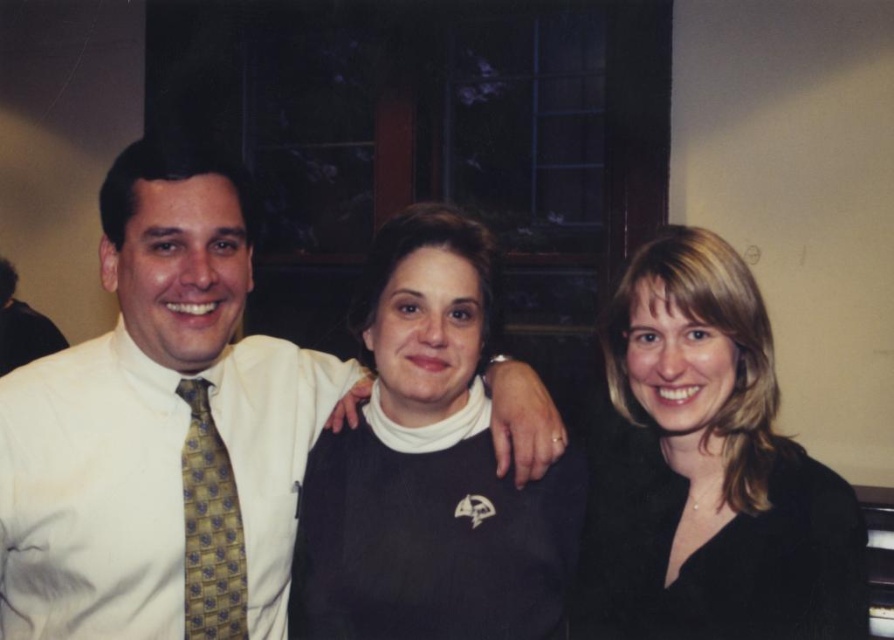
Between point (452, 230) and point (10, 324), which one is positioned behind?

The point (10, 324) is behind.

Which is below, black sweater at center or matte gold tie at left?

black sweater at center

Image resolution: width=894 pixels, height=640 pixels. I want to click on black sweater at center, so click(428, 468).

Does white shirt at left appear on the right side of yellowpatterned fabrictie at left?

Incorrect, white shirt at left is not on the right side of yellowpatterned fabrictie at left.

Is point (344, 362) positioned in front of point (218, 451)?

No, it is not.

Where is `white shirt at left`? The height and width of the screenshot is (640, 894). white shirt at left is located at coordinates (161, 432).

Between white shirt at left and matte gold tie at left, which one has more height?

With more height is white shirt at left.

The height and width of the screenshot is (640, 894). Identify the location of white shirt at left. (161, 432).

Find the location of a particular element. This screenshot has height=640, width=894. white shirt at left is located at coordinates (161, 432).